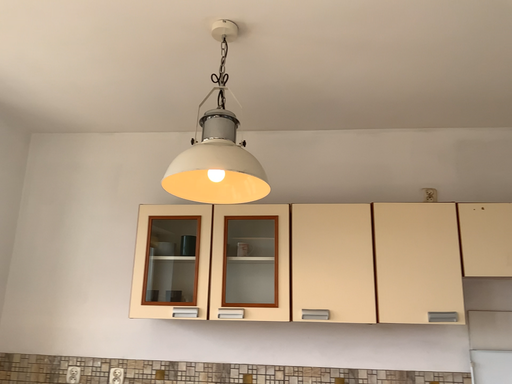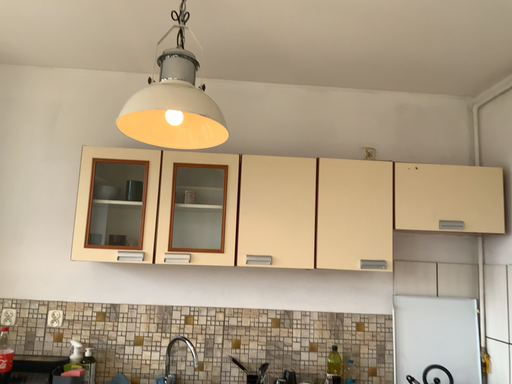
Question: How did the camera likely rotate when shooting the video?

Choices:
 (A) rotated downward
 (B) rotated upward

Answer: (A)